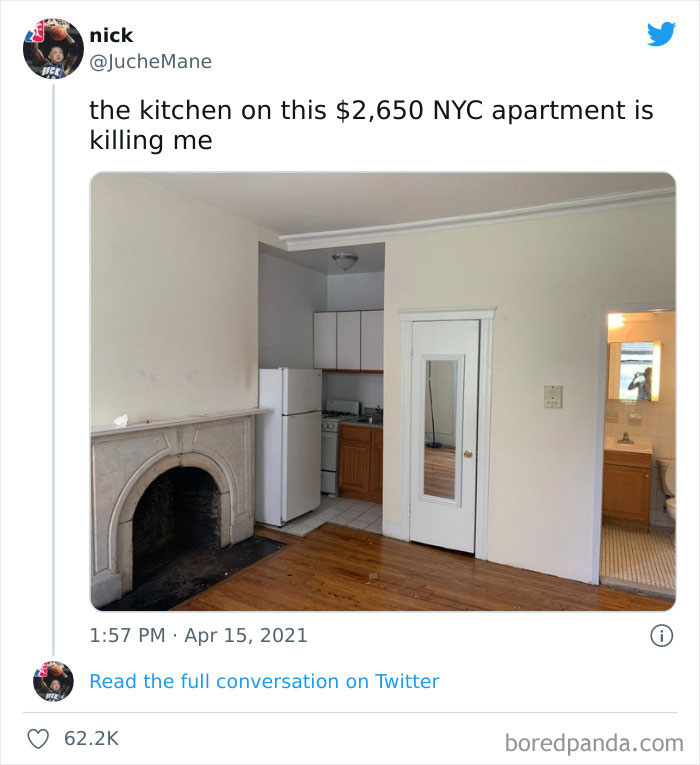
Where is `sink`? The width and height of the screenshot is (700, 765). sink is located at coordinates (631, 446).